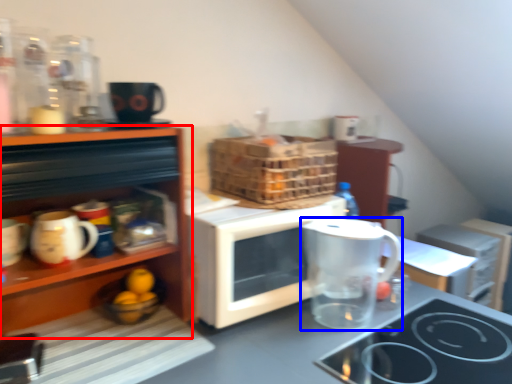
Question: Which point is further to the camera, cabinetry (highlighted by a red box) or jug (highlighted by a blue box)?

Choices:
 (A) cabinetry
 (B) jug

Answer: (B)